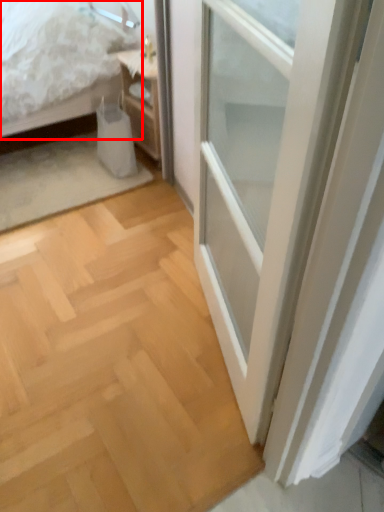
Question: From the image's perspective, what is the correct spatial positioning of bed (annotated by the red box) in reference to nightstand?

Choices:
 (A) below
 (B) above

Answer: (B)